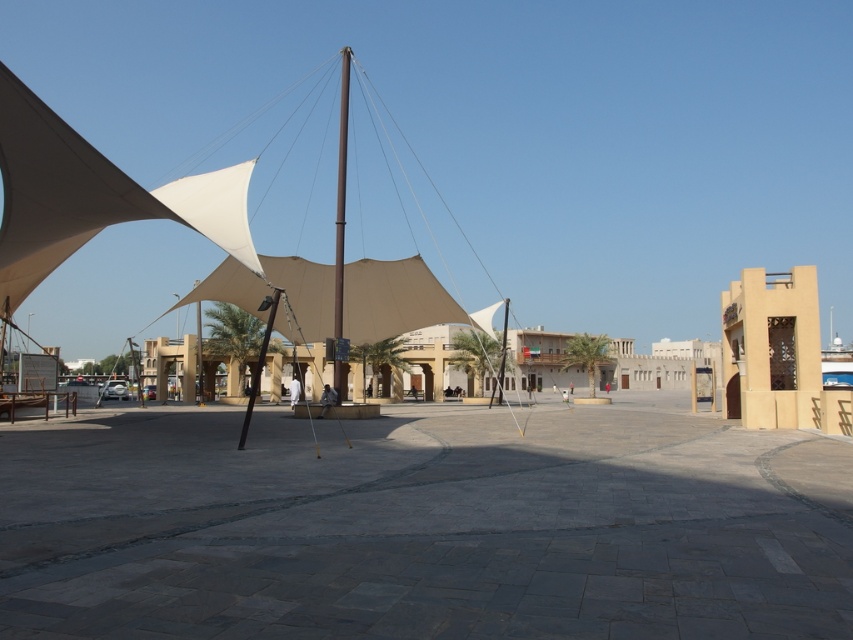
Does smooth gray pole at center appear on the left side of black metal pole at center?

No, smooth gray pole at center is not to the left of black metal pole at center.

Is point (346, 52) positioned after point (250, 388)?

No, it is in front of (250, 388).

Image resolution: width=853 pixels, height=640 pixels. In order to click on smooth gray pole at center in this screenshot , I will do [x=340, y=195].

Is smooth stone pavement at center bigger than smooth gray pole at center?

Actually, smooth stone pavement at center might be smaller than smooth gray pole at center.

Which is more to the right, smooth stone pavement at center or smooth gray pole at center?

Positioned to the right is smooth stone pavement at center.

Which is in front, point (682, 499) or point (340, 205)?

Point (682, 499) is more forward.

At what (x,y) coordinates should I click in order to perform the action: click on smooth stone pavement at center. Please return your answer as a coordinate pair (x, y). This screenshot has width=853, height=640. Looking at the image, I should click on (424, 525).

Can you confirm if beige fabric canopy at center is smaller than smooth gray pole at center?

Correct, beige fabric canopy at center occupies less space than smooth gray pole at center.

The width and height of the screenshot is (853, 640). Describe the element at coordinates (393, 300) in the screenshot. I see `beige fabric canopy at center` at that location.

The height and width of the screenshot is (640, 853). Identify the location of beige fabric canopy at center. (393, 300).

Locate an element on the screen. The image size is (853, 640). beige fabric canopy at center is located at coordinates (393, 300).